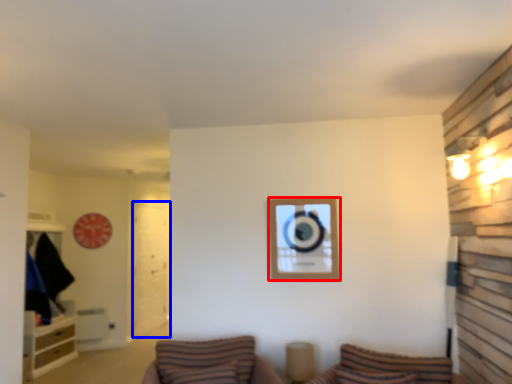
Question: Which object is further to the camera taking this photo, picture frame (highlighted by a red box) or glass door (highlighted by a blue box)?

Choices:
 (A) picture frame
 (B) glass door

Answer: (B)